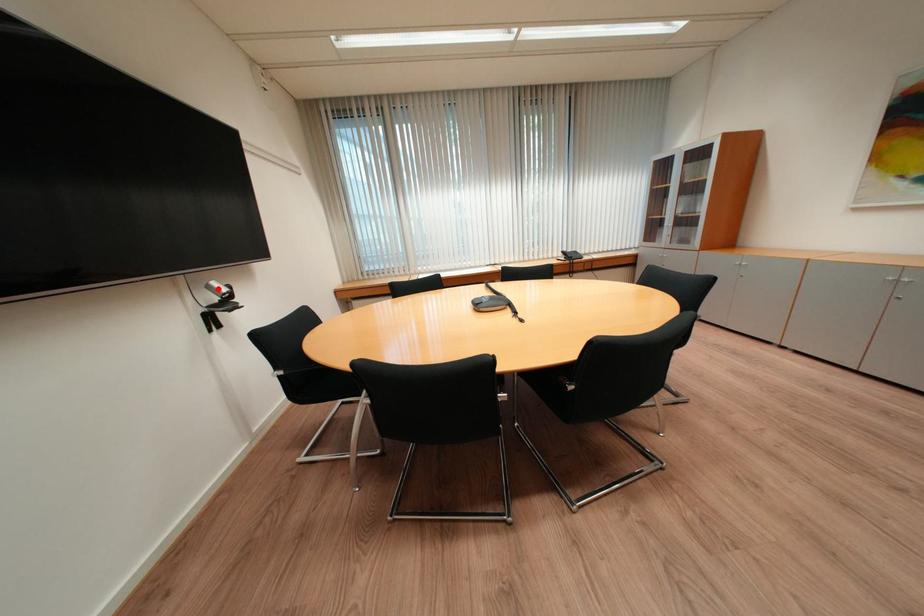
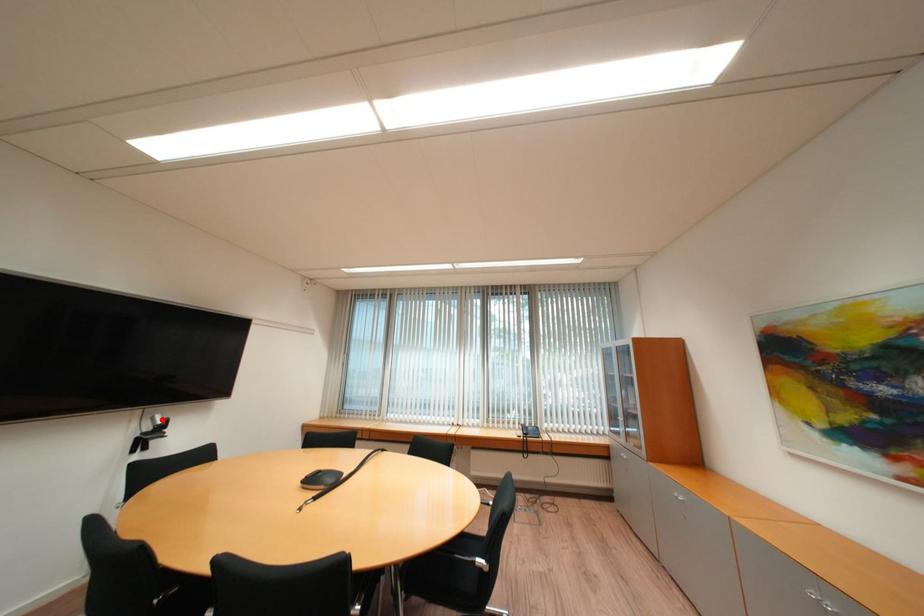
I am providing you with two images of the same scene from different viewpoints. A red point is marked on the first image and another point is marked on the second image. Does the point marked in image1 correspond to the same location as the one in image2?

Yes